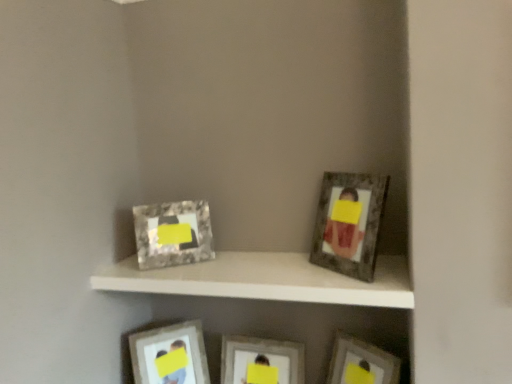
This screenshot has height=384, width=512. What are the coordinates of `matte silver picture frame at upper right, positioned as the 4th picture frame in left-to-right order` in the screenshot? It's located at (349, 223).

Measure the distance between metallic silver picture frame at lower right, which ranks as the 1th picture frame in right-to-left order, and camera.

metallic silver picture frame at lower right, which ranks as the 1th picture frame in right-to-left order, is 1.54 meters away from camera.

This screenshot has width=512, height=384. In order to click on matte silver picture frame at center, arranged as the third picture frame when viewed from the left in this screenshot , I will do `click(261, 356)`.

How much space does matte silver picture frame at lower center, the first picture frame when ordered from left to right, occupy vertically?

matte silver picture frame at lower center, the first picture frame when ordered from left to right, is 14.47 inches in height.

Where is `matte silver picture frame at upper right, positioned as the 4th picture frame in left-to-right order`? This screenshot has height=384, width=512. matte silver picture frame at upper right, positioned as the 4th picture frame in left-to-right order is located at coordinates (349, 223).

This screenshot has height=384, width=512. Identify the location of shelf that is above the matte silver picture frame at lower center, acting as the fifth picture frame starting from the right (from the image's perspective). (264, 280).

Is matte silver picture frame at lower center, the first picture frame when ordered from left to right, wider than white matte shelf at center?

No, matte silver picture frame at lower center, the first picture frame when ordered from left to right, is not wider than white matte shelf at center.

Is matte silver picture frame at lower center, the first picture frame when ordered from left to right, spatially inside white matte shelf at center, or outside of it?

matte silver picture frame at lower center, the first picture frame when ordered from left to right, cannot be found inside white matte shelf at center.

Based on the photo, from a real-world perspective, is matte silver picture frame at lower center, the first picture frame when ordered from left to right, over white matte shelf at center?

No, from a real-world perspective, matte silver picture frame at lower center, the first picture frame when ordered from left to right, is not above white matte shelf at center.

Looking at this image, is metallic silver picture frame at lower right, acting as the 5th picture frame starting from the left, positioned before matte silver picture frame at center, arranged as the third picture frame when viewed from the left?

Yes.

Does metallic silver picture frame at lower right, acting as the 5th picture frame starting from the left, have a greater height compared to matte silver picture frame at center, arranged as the third picture frame when viewed from the left?

No, metallic silver picture frame at lower right, acting as the 5th picture frame starting from the left, is not taller than matte silver picture frame at center, arranged as the third picture frame when viewed from the left.

Is metallic silver picture frame at lower right, which ranks as the 1th picture frame in right-to-left order, to the left or to the right of matte silver picture frame at center, arranged as the third picture frame when viewed from the left, in the image?

From the image, it's evident that metallic silver picture frame at lower right, which ranks as the 1th picture frame in right-to-left order, is to the right of matte silver picture frame at center, arranged as the third picture frame when viewed from the left.

From the image's perspective, is metallic silver picture frame at lower right, acting as the 5th picture frame starting from the left, below matte silver picture frame at center, which ranks as the third picture frame in right-to-left order?

No.

Is matte silver picture frame at lower center, acting as the fifth picture frame starting from the right, in contact with metallic silver picture frame at lower right, which ranks as the 1th picture frame in right-to-left order?

matte silver picture frame at lower center, acting as the fifth picture frame starting from the right, is not next to metallic silver picture frame at lower right, which ranks as the 1th picture frame in right-to-left order, and they're not touching.

Considering the sizes of matte silver picture frame at lower center, acting as the fifth picture frame starting from the right, and metallic silver picture frame at lower right, which ranks as the 1th picture frame in right-to-left order, in the image, is matte silver picture frame at lower center, acting as the fifth picture frame starting from the right, taller or shorter than metallic silver picture frame at lower right, which ranks as the 1th picture frame in right-to-left order,?

Clearly, matte silver picture frame at lower center, acting as the fifth picture frame starting from the right, is taller compared to metallic silver picture frame at lower right, which ranks as the 1th picture frame in right-to-left order.

From a real-world perspective, is matte silver picture frame at lower center, acting as the fifth picture frame starting from the right, located higher than metallic silver picture frame at lower right, acting as the 5th picture frame starting from the left?

No.

Based on the photo, is matte silver picture frame at lower center, acting as the fifth picture frame starting from the right, at the right side of metallic silver picture frame at lower right, which ranks as the 1th picture frame in right-to-left order?

In fact, matte silver picture frame at lower center, acting as the fifth picture frame starting from the right, is to the left of metallic silver picture frame at lower right, which ranks as the 1th picture frame in right-to-left order.

Based on the photo, is matte silver picture frame at upper right, positioned as the 4th picture frame in left-to-right order, at the left side of white matte shelf at center?

In fact, matte silver picture frame at upper right, positioned as the 4th picture frame in left-to-right order, is to the right of white matte shelf at center.

Is white matte shelf at center inside matte silver picture frame at upper right, positioned as the 4th picture frame in left-to-right order?

Actually, white matte shelf at center is outside matte silver picture frame at upper right, positioned as the 4th picture frame in left-to-right order.

Can you confirm if matte silver picture frame at upper right, positioned as the 4th picture frame in left-to-right order, is taller than white matte shelf at center?

Correct, matte silver picture frame at upper right, positioned as the 4th picture frame in left-to-right order, is much taller as white matte shelf at center.

From the image's perspective, is marble-like frame at upper left, positioned as the 2th picture frame in left-to-right order, above matte silver picture frame at lower center, acting as the fifth picture frame starting from the right?

Indeed, from the image's perspective, marble-like frame at upper left, positioned as the 2th picture frame in left-to-right order, is shown above matte silver picture frame at lower center, acting as the fifth picture frame starting from the right.

Is marble-like frame at upper left, positioned as the 2th picture frame in left-to-right order, to the left or to the right of matte silver picture frame at lower center, the first picture frame when ordered from left to right, in the image?

In the image, marble-like frame at upper left, positioned as the 2th picture frame in left-to-right order, appears on the right side of matte silver picture frame at lower center, the first picture frame when ordered from left to right.

Which object is closer to the camera taking this photo, marble-like frame at upper left, the fourth picture frame positioned from the right, or matte silver picture frame at lower center, the first picture frame when ordered from left to right?

marble-like frame at upper left, the fourth picture frame positioned from the right.

Considering the sizes of objects marble-like frame at upper left, positioned as the 2th picture frame in left-to-right order, and matte silver picture frame at lower center, the first picture frame when ordered from left to right, in the image provided, who is bigger, marble-like frame at upper left, positioned as the 2th picture frame in left-to-right order, or matte silver picture frame at lower center, the first picture frame when ordered from left to right,?

With larger size is matte silver picture frame at lower center, the first picture frame when ordered from left to right.

Between white matte shelf at center and metallic silver picture frame at lower right, acting as the 5th picture frame starting from the left, which one appears on the right side from the viewer's perspective?

Positioned to the right is metallic silver picture frame at lower right, acting as the 5th picture frame starting from the left.

Is white matte shelf at center looking in the opposite direction of metallic silver picture frame at lower right, which ranks as the 1th picture frame in right-to-left order?

white matte shelf at center is not turned away from metallic silver picture frame at lower right, which ranks as the 1th picture frame in right-to-left order.

Between white matte shelf at center and metallic silver picture frame at lower right, acting as the 5th picture frame starting from the left, which one is positioned behind?

metallic silver picture frame at lower right, acting as the 5th picture frame starting from the left, is behind.

Based on their sizes in the image, would you say white matte shelf at center is bigger or smaller than metallic silver picture frame at lower right, which ranks as the 1th picture frame in right-to-left order?

Clearly, white matte shelf at center is larger in size than metallic silver picture frame at lower right, which ranks as the 1th picture frame in right-to-left order.

Considering the relative sizes of matte silver picture frame at center, which ranks as the third picture frame in right-to-left order, and matte silver picture frame at lower center, acting as the fifth picture frame starting from the right, in the image provided, is matte silver picture frame at center, which ranks as the third picture frame in right-to-left order, wider than matte silver picture frame at lower center, acting as the fifth picture frame starting from the right,?

Correct, the width of matte silver picture frame at center, which ranks as the third picture frame in right-to-left order, exceeds that of matte silver picture frame at lower center, acting as the fifth picture frame starting from the right.

Identify the location of picture frame below the matte silver picture frame at lower center, the first picture frame when ordered from left to right (from the image's perspective). (261, 356).

Measure the distance between matte silver picture frame at center, arranged as the third picture frame when viewed from the left, and matte silver picture frame at lower center, the first picture frame when ordered from left to right.

They are 10.22 inches apart.

Can you tell me how much matte silver picture frame at center, arranged as the third picture frame when viewed from the left, and matte silver picture frame at lower center, acting as the fifth picture frame starting from the right, differ in facing direction?

There is a 45.2-degree angle between the facing directions of matte silver picture frame at center, arranged as the third picture frame when viewed from the left, and matte silver picture frame at lower center, acting as the fifth picture frame starting from the right.

Identify the location of picture frame that is the 2nd one below the white matte shelf at center (from a real-world perspective). This screenshot has width=512, height=384. (170, 355).

From the image's perspective, count 2nd picture frames upward from the matte silver picture frame at center, which ranks as the third picture frame in right-to-left order, and point to it. Please provide its 2D coordinates.

[(361, 363)]

Considering their positions, is matte silver picture frame at center, which ranks as the third picture frame in right-to-left order, positioned further to metallic silver picture frame at lower right, acting as the 5th picture frame starting from the left, than matte silver picture frame at lower center, acting as the fifth picture frame starting from the right?

matte silver picture frame at lower center, acting as the fifth picture frame starting from the right, is further to metallic silver picture frame at lower right, acting as the 5th picture frame starting from the left.

When comparing their distances from metallic silver picture frame at lower right, acting as the 5th picture frame starting from the left, does matte silver picture frame at lower center, acting as the fifth picture frame starting from the right, or matte silver picture frame at upper right, positioned as the 4th picture frame in left-to-right order, seem closer?

matte silver picture frame at upper right, positioned as the 4th picture frame in left-to-right order, is closer to metallic silver picture frame at lower right, acting as the 5th picture frame starting from the left.

Consider the image. Considering their positions, is white matte shelf at center positioned further to matte silver picture frame at center, which ranks as the third picture frame in right-to-left order, than metallic silver picture frame at lower right, which ranks as the 1th picture frame in right-to-left order?

white matte shelf at center is further to matte silver picture frame at center, which ranks as the third picture frame in right-to-left order.

Considering their positions, is matte silver picture frame at lower center, the first picture frame when ordered from left to right, positioned closer to matte silver picture frame at center, arranged as the third picture frame when viewed from the left, than metallic silver picture frame at lower right, which ranks as the 1th picture frame in right-to-left order?

matte silver picture frame at lower center, the first picture frame when ordered from left to right, is closer to matte silver picture frame at center, arranged as the third picture frame when viewed from the left.

Looking at this image, looking at the image, which one is located closer to white matte shelf at center, matte silver picture frame at upper right, positioned as the 4th picture frame in left-to-right order, or matte silver picture frame at center, arranged as the third picture frame when viewed from the left?

matte silver picture frame at upper right, positioned as the 4th picture frame in left-to-right order.

Considering their positions, is metallic silver picture frame at lower right, which ranks as the 1th picture frame in right-to-left order, positioned further to matte silver picture frame at upper right, which is the second picture frame from right to left, than matte silver picture frame at center, which ranks as the third picture frame in right-to-left order?

The object further to matte silver picture frame at upper right, which is the second picture frame from right to left, is matte silver picture frame at center, which ranks as the third picture frame in right-to-left order.

Which object lies nearer to the anchor point white matte shelf at center, matte silver picture frame at lower center, acting as the fifth picture frame starting from the right, or marble-like frame at upper left, positioned as the 2th picture frame in left-to-right order?

The object closer to white matte shelf at center is marble-like frame at upper left, positioned as the 2th picture frame in left-to-right order.

Which object lies further to the anchor point matte silver picture frame at center, which ranks as the third picture frame in right-to-left order, metallic silver picture frame at lower right, which ranks as the 1th picture frame in right-to-left order, or marble-like frame at upper left, the fourth picture frame positioned from the right?

Among the two, marble-like frame at upper left, the fourth picture frame positioned from the right, is located further to matte silver picture frame at center, which ranks as the third picture frame in right-to-left order.

I want to click on shelf situated between marble-like frame at upper left, positioned as the 2th picture frame in left-to-right order, and metallic silver picture frame at lower right, acting as the 5th picture frame starting from the left, from left to right, so click(x=264, y=280).

Where is `shelf between marble-like frame at upper left, positioned as the 2th picture frame in left-to-right order, and matte silver picture frame at upper right, positioned as the 4th picture frame in left-to-right order`? The image size is (512, 384). shelf between marble-like frame at upper left, positioned as the 2th picture frame in left-to-right order, and matte silver picture frame at upper right, positioned as the 4th picture frame in left-to-right order is located at coordinates (264, 280).

I want to click on shelf between matte silver picture frame at upper right, positioned as the 4th picture frame in left-to-right order, and metallic silver picture frame at lower right, which ranks as the 1th picture frame in right-to-left order, from top to bottom, so click(264, 280).

The width and height of the screenshot is (512, 384). In order to click on shelf between matte silver picture frame at upper right, which is the second picture frame from right to left, and matte silver picture frame at center, which ranks as the third picture frame in right-to-left order, in the up-down direction in this screenshot , I will do `click(264, 280)`.